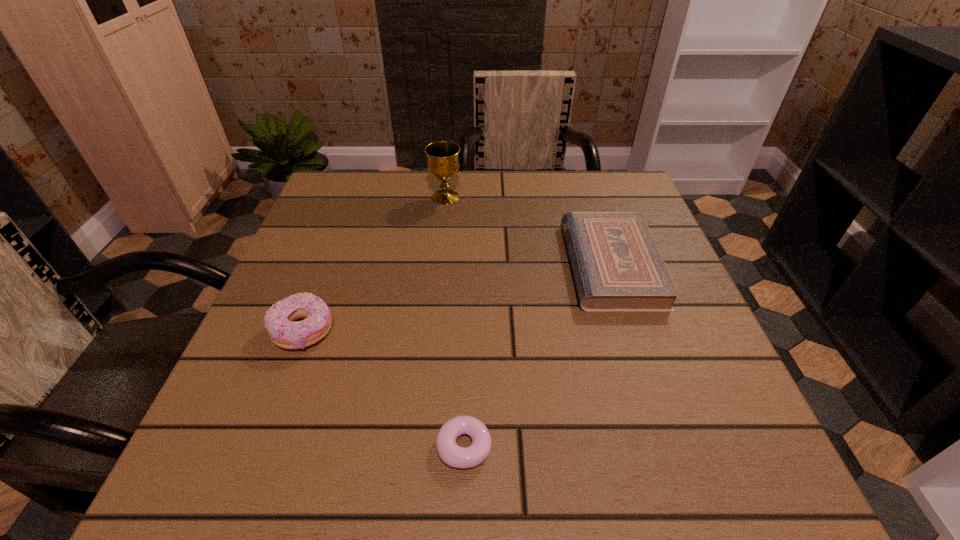
Identify the location of the tallest object. (443, 163).

I want to click on chalice, so click(x=443, y=163).

The width and height of the screenshot is (960, 540). I want to click on the taller doughnut, so click(x=278, y=320).

Image resolution: width=960 pixels, height=540 pixels. In order to click on the leftmost object in this screenshot , I will do `click(278, 320)`.

Identify the location of Bible. (617, 266).

Find the location of a particular element. This screenshot has height=540, width=960. the rightmost object is located at coordinates (617, 266).

This screenshot has height=540, width=960. What are the coordinates of `the nearer doughnut` in the screenshot? It's located at (453, 455).

The width and height of the screenshot is (960, 540). What are the coordinates of `the shortest object` in the screenshot? It's located at (453, 455).

The height and width of the screenshot is (540, 960). I want to click on free region located on the right of the chalice, so click(x=557, y=197).

This screenshot has height=540, width=960. I want to click on free space located on the right of the left doughnut, so click(x=505, y=331).